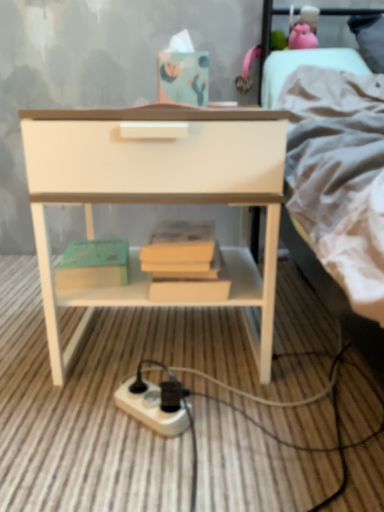
The height and width of the screenshot is (512, 384). I want to click on unoccupied space behind white plastic power plugs and sockets at lower center, so click(x=157, y=359).